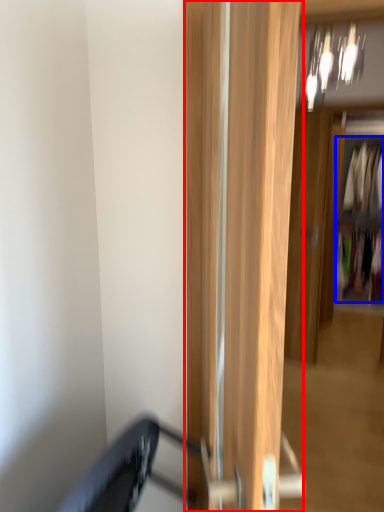
Question: Which object appears farthest to the camera in this image, door (highlighted by a red box) or clothing (highlighted by a blue box)?

Choices:
 (A) door
 (B) clothing

Answer: (B)